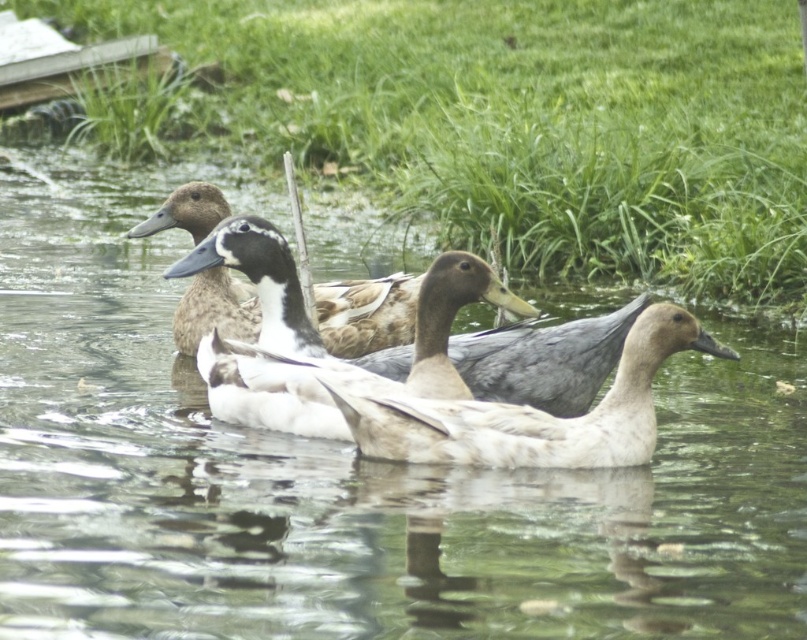
You are a photographer trying to capture a closeup of the ducks in the pond. You notice two points of interest marked as point 1 at coordinates point (x=462, y=61) and point 2 at coordinates point (x=559, y=435). Which point should you focus on to get a clearer image of the ducks?

Point 1 at coordinates point (x=462, y=61) is closer to the camera, so focusing on it will result in a clearer image of the ducks.

You are standing on the wooden structure in the top left corner of the image. You see the green grass at center and the white matte duck at center. Which object is closer to you in terms of vertical position?

The white matte duck at center is closer to you because the green grass at center is located above it, meaning the duck is positioned lower vertically.

You are standing on the edge of the pond and see two points in the water, one at point (444, 396) and the other at point (387, 456). Which point is closer to you?

Point (387, 456) is closer to you because it is less further to the camera than point (444, 396).